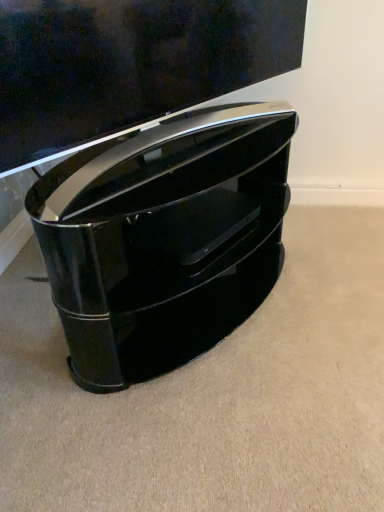
This screenshot has height=512, width=384. Describe the element at coordinates (164, 238) in the screenshot. I see `glossy black tv stand at center` at that location.

I want to click on glossy black tv stand at center, so click(164, 238).

Where is `glossy black tv stand at lower center`? glossy black tv stand at lower center is located at coordinates (129, 64).

The image size is (384, 512). What do you see at coordinates (129, 64) in the screenshot? I see `glossy black tv stand at lower center` at bounding box center [129, 64].

What are the coordinates of `glossy black tv stand at center` in the screenshot? It's located at (164, 238).

Is glossy black tv stand at lower center to the left of glossy black tv stand at center from the viewer's perspective?

Incorrect, glossy black tv stand at lower center is not on the left side of glossy black tv stand at center.

Is glossy black tv stand at lower center further to camera compared to glossy black tv stand at center?

No, it is not.

Is point (239, 55) behind point (156, 220)?

Yes, point (239, 55) is farther from viewer.

From the image's perspective, between glossy black tv stand at lower center and glossy black tv stand at center, which one is located above?

glossy black tv stand at lower center appears higher in the image.

From a real-world perspective, between glossy black tv stand at lower center and glossy black tv stand at center, who is vertically higher?

glossy black tv stand at lower center, from a real-world perspective.

Considering the relative sizes of glossy black tv stand at lower center and glossy black tv stand at center in the image provided, is glossy black tv stand at lower center wider than glossy black tv stand at center?

No, glossy black tv stand at lower center is not wider than glossy black tv stand at center.

Can you confirm if glossy black tv stand at lower center is taller than glossy black tv stand at center?

Incorrect, the height of glossy black tv stand at lower center is not larger of that of glossy black tv stand at center.

Can you confirm if glossy black tv stand at lower center is smaller than glossy black tv stand at center?

Yes, glossy black tv stand at lower center is smaller than glossy black tv stand at center.

Choose the correct answer: Is glossy black tv stand at lower center inside glossy black tv stand at center or outside it?

glossy black tv stand at lower center is located beyond the bounds of glossy black tv stand at center.

Is glossy black tv stand at lower center far away from glossy black tv stand at center?

No, there isn't a large distance between glossy black tv stand at lower center and glossy black tv stand at center.

Is glossy black tv stand at lower center aimed at glossy black tv stand at center?

No, glossy black tv stand at lower center is not aimed at glossy black tv stand at center.

What's the angular difference between glossy black tv stand at lower center and glossy black tv stand at center's facing directions?

The angular difference between glossy black tv stand at lower center and glossy black tv stand at center is 1.19 degrees.

You are a GUI agent. You are given a task and a screenshot of the screen. Output one action in this format:
    pyautogui.click(x=<x>, y=<y>)
    Task: Click on the television that is in front of the glossy black tv stand at center
    Image resolution: width=384 pixels, height=512 pixels.
    Given the screenshot: What is the action you would take?
    pyautogui.click(x=129, y=64)

Is glossy black tv stand at center at the left side of glossy black tv stand at lower center?

Yes.

Which is behind, glossy black tv stand at center or glossy black tv stand at lower center?

glossy black tv stand at center is more distant.

Which point is more distant from viewer, (89,164) or (111,115)?

The point (89,164) is farther.

From the image's perspective, is glossy black tv stand at center positioned above or below glossy black tv stand at lower center?

Based on their image positions, glossy black tv stand at center is located beneath glossy black tv stand at lower center.

From a real-world perspective, which is physically above, glossy black tv stand at center or glossy black tv stand at lower center?

glossy black tv stand at lower center.

Can you confirm if glossy black tv stand at center is thinner than glossy black tv stand at lower center?

In fact, glossy black tv stand at center might be wider than glossy black tv stand at lower center.

Is glossy black tv stand at center taller or shorter than glossy black tv stand at lower center?

Considering their sizes, glossy black tv stand at center has more height than glossy black tv stand at lower center.

Can you confirm if glossy black tv stand at center is smaller than glossy black tv stand at lower center?

No.

Which is correct: glossy black tv stand at center is inside glossy black tv stand at lower center, or outside of it?

glossy black tv stand at center is not enclosed by glossy black tv stand at lower center.

Is glossy black tv stand at center positioned far away from glossy black tv stand at lower center?

glossy black tv stand at center is near glossy black tv stand at lower center, not far away.

Is glossy black tv stand at center oriented away from glossy black tv stand at lower center?

No, glossy black tv stand at center's orientation is not away from glossy black tv stand at lower center.

You are a GUI agent. You are given a task and a screenshot of the screen. Output one action in this format:
    pyautogui.click(x=<x>, y=<y>)
    Task: Click on the television in front of the glossy black tv stand at center
    The height and width of the screenshot is (512, 384).
    Given the screenshot: What is the action you would take?
    pyautogui.click(x=129, y=64)

This screenshot has width=384, height=512. In order to click on furniture below the glossy black tv stand at lower center (from the image's perspective) in this screenshot , I will do `click(164, 238)`.

Locate an element on the screen. furniture on the left side of glossy black tv stand at lower center is located at coordinates (164, 238).